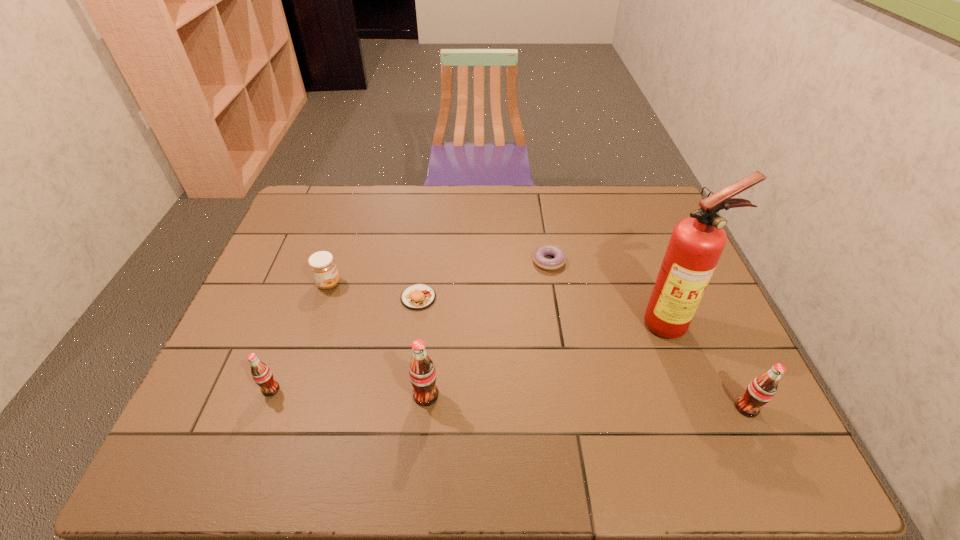
Where is `fire extinguisher`? fire extinguisher is located at coordinates (696, 244).

Identify the location of free space located 0.130m on the back of the shortest soda. This screenshot has height=540, width=960. (290, 338).

Where is `vacant space situated on the left of the second soda from right to left`? Image resolution: width=960 pixels, height=540 pixels. vacant space situated on the left of the second soda from right to left is located at coordinates (323, 395).

Where is `free space located on the left of the fifth shortest object`? Image resolution: width=960 pixels, height=540 pixels. free space located on the left of the fifth shortest object is located at coordinates (635, 408).

Image resolution: width=960 pixels, height=540 pixels. Identify the location of vacant position located on the back of the doughnut. (540, 202).

Where is `vacant space located on the front label of the jam`? The image size is (960, 540). vacant space located on the front label of the jam is located at coordinates (468, 284).

This screenshot has width=960, height=540. Find the location of `vacant region located on the right of the sixth tallest object`. vacant region located on the right of the sixth tallest object is located at coordinates (465, 298).

Find the location of a particular element. The image size is (960, 540). vacant area situated on the front-facing side of the fire extinguisher is located at coordinates (700, 398).

Identify the location of object situated at the left edge. This screenshot has height=540, width=960. (261, 373).

Locate an element on the screen. This screenshot has height=540, width=960. soda that is positioned at the right edge is located at coordinates (761, 390).